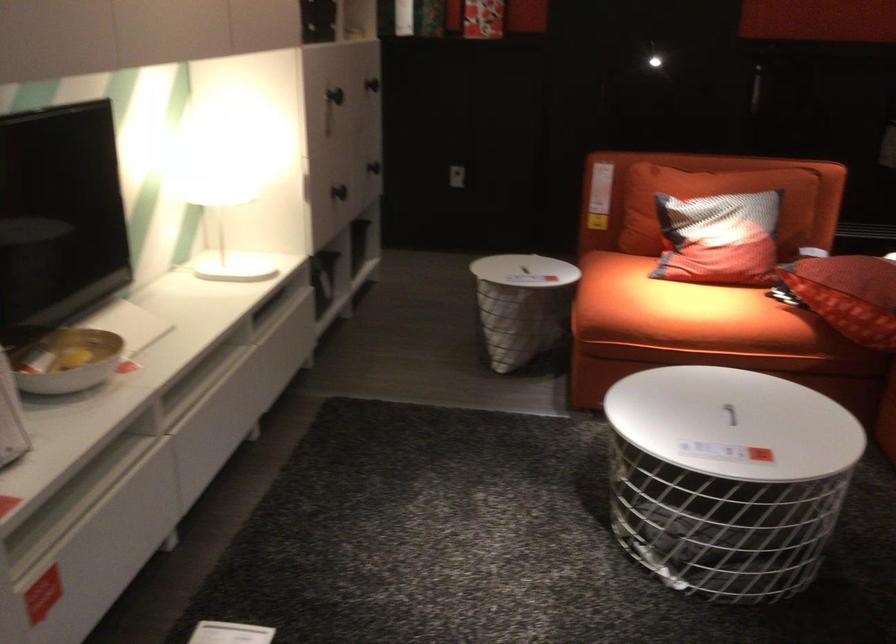
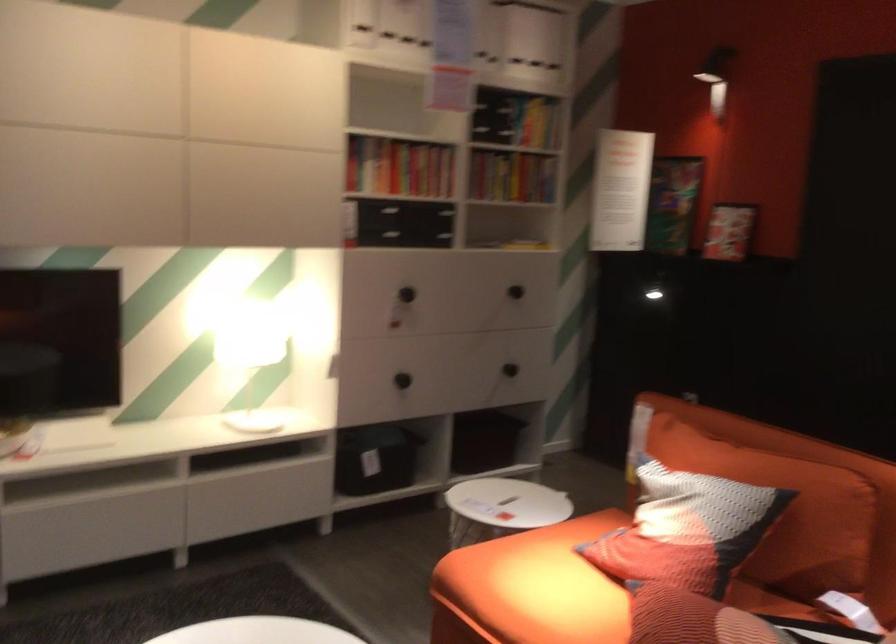
In the second image, find the point that corresponds to pixel 236 198 in the first image.

(250, 354)